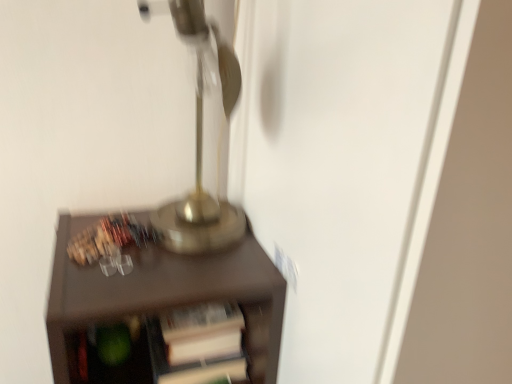
Question: Should I look upward or downward to see gold metallic table lamp at upper center?

Choices:
 (A) down
 (B) up

Answer: (B)

Question: Could you tell me if gold metallic table lamp at upper center is turned towards brown matte cabinet at center?

Choices:
 (A) yes
 (B) no

Answer: (B)

Question: Can you confirm if gold metallic table lamp at upper center is positioned to the right of brown matte cabinet at center?

Choices:
 (A) yes
 (B) no

Answer: (A)

Question: Is gold metallic table lamp at upper center positioned with its back to brown matte cabinet at center?

Choices:
 (A) no
 (B) yes

Answer: (A)

Question: Considering the relative sizes of gold metallic table lamp at upper center and brown matte cabinet at center in the image provided, is gold metallic table lamp at upper center wider than brown matte cabinet at center?

Choices:
 (A) yes
 (B) no

Answer: (B)

Question: From a real-world perspective, is gold metallic table lamp at upper center on brown matte cabinet at center?

Choices:
 (A) no
 (B) yes

Answer: (B)

Question: Considering the relative sizes of gold metallic table lamp at upper center and brown matte cabinet at center in the image provided, is gold metallic table lamp at upper center thinner than brown matte cabinet at center?

Choices:
 (A) yes
 (B) no

Answer: (A)

Question: Does brown matte cabinet at center have a lesser height compared to gold metallic table lamp at upper center?

Choices:
 (A) no
 (B) yes

Answer: (A)

Question: From the image's perspective, is brown matte cabinet at center located beneath gold metallic table lamp at upper center?

Choices:
 (A) no
 (B) yes

Answer: (B)

Question: Considering the relative positions of brown matte cabinet at center and gold metallic table lamp at upper center in the image provided, is brown matte cabinet at center to the left of gold metallic table lamp at upper center from the viewer's perspective?

Choices:
 (A) no
 (B) yes

Answer: (B)

Question: Are brown matte cabinet at center and gold metallic table lamp at upper center beside each other?

Choices:
 (A) no
 (B) yes

Answer: (A)

Question: Considering the relative sizes of brown matte cabinet at center and gold metallic table lamp at upper center in the image provided, is brown matte cabinet at center taller than gold metallic table lamp at upper center?

Choices:
 (A) yes
 (B) no

Answer: (A)

Question: Considering the relative positions of brown matte cabinet at center and gold metallic table lamp at upper center in the image provided, is brown matte cabinet at center to the right of gold metallic table lamp at upper center from the viewer's perspective?

Choices:
 (A) yes
 (B) no

Answer: (B)

Question: Is brown matte cabinet at center situated inside gold metallic table lamp at upper center or outside?

Choices:
 (A) outside
 (B) inside

Answer: (A)